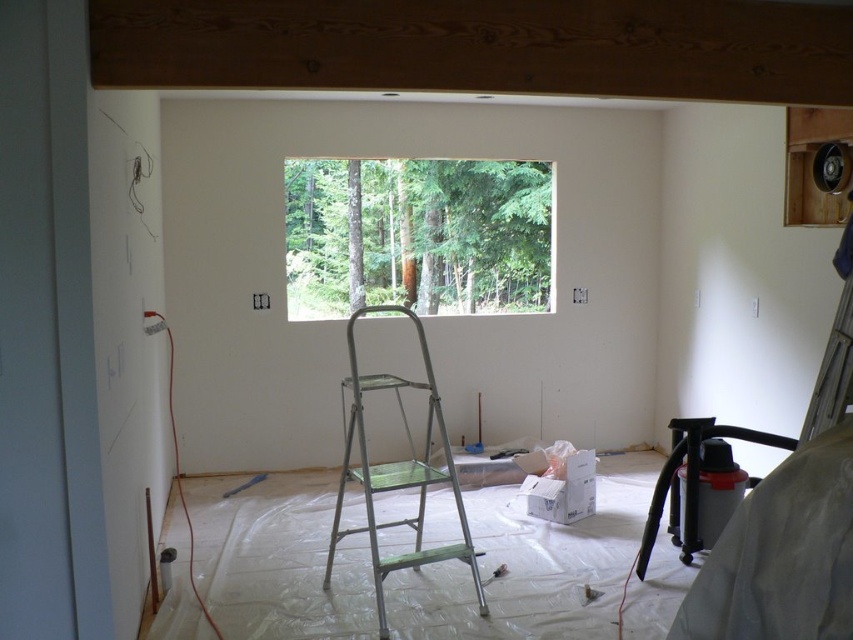
Question: Which point is farther to the camera?

Choices:
 (A) metallic silver step ladder at center
 (B) transparent glass window at center

Answer: (B)

Question: Is transparent glass window at center above metallic silver step ladder at center?

Choices:
 (A) yes
 (B) no

Answer: (A)

Question: Is transparent glass window at center to the right of metallic silver step ladder at center from the viewer's perspective?

Choices:
 (A) no
 (B) yes

Answer: (B)

Question: Which of the following is the farthest from the observer?

Choices:
 (A) (514, 262)
 (B) (460, 515)

Answer: (A)

Question: From the image, what is the correct spatial relationship of transparent glass window at center in relation to metallic silver step ladder at center?

Choices:
 (A) below
 (B) above

Answer: (B)